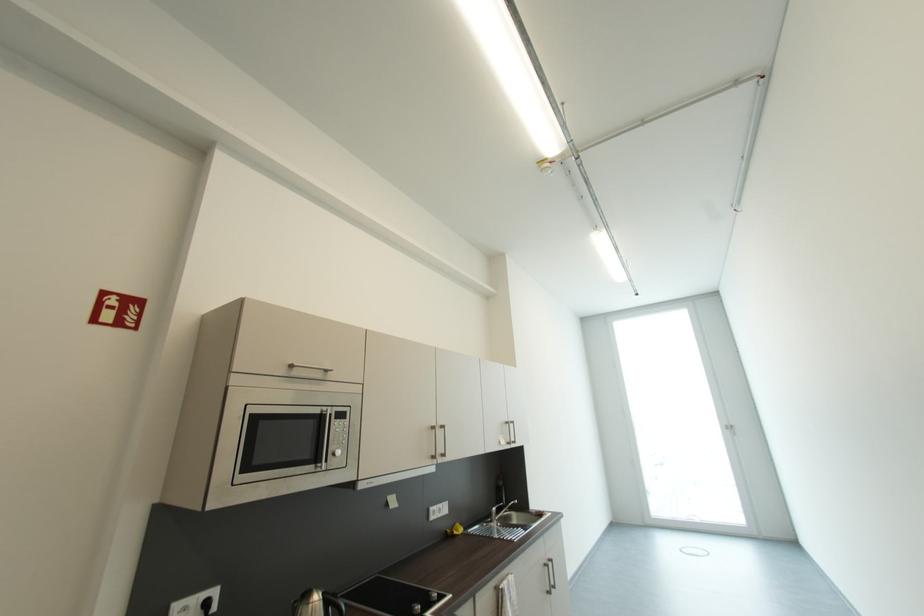
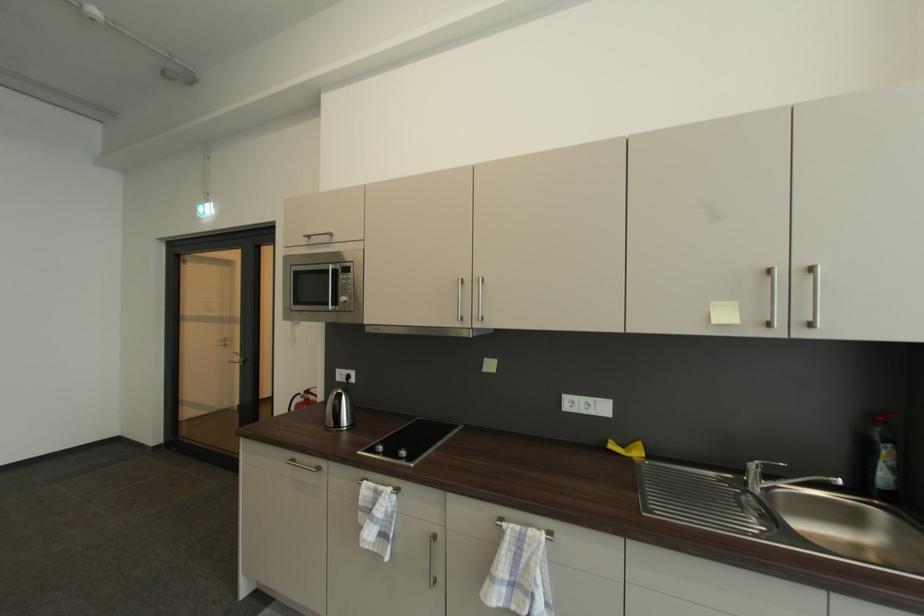
Find the pixel in the second image that matches (506,479) in the first image.

(885, 419)